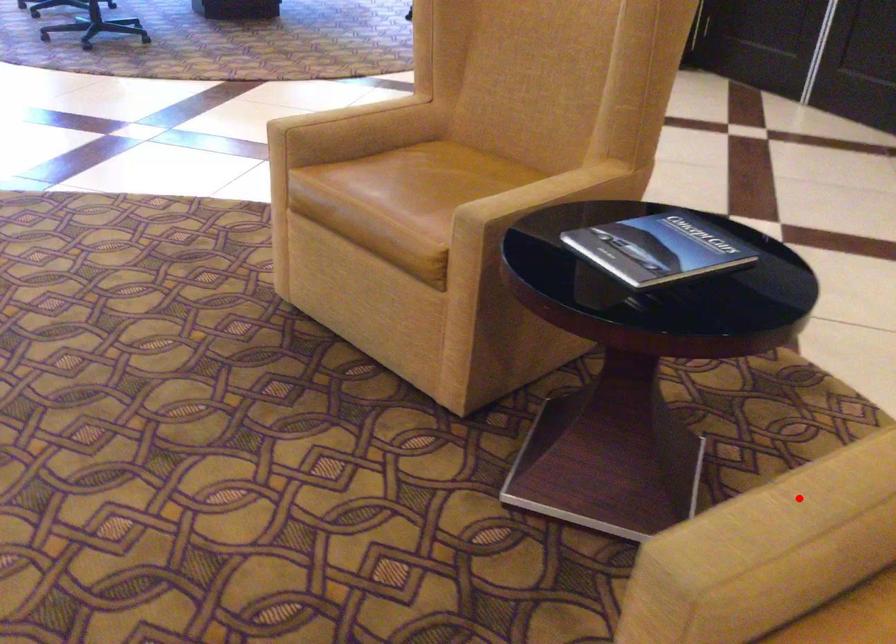
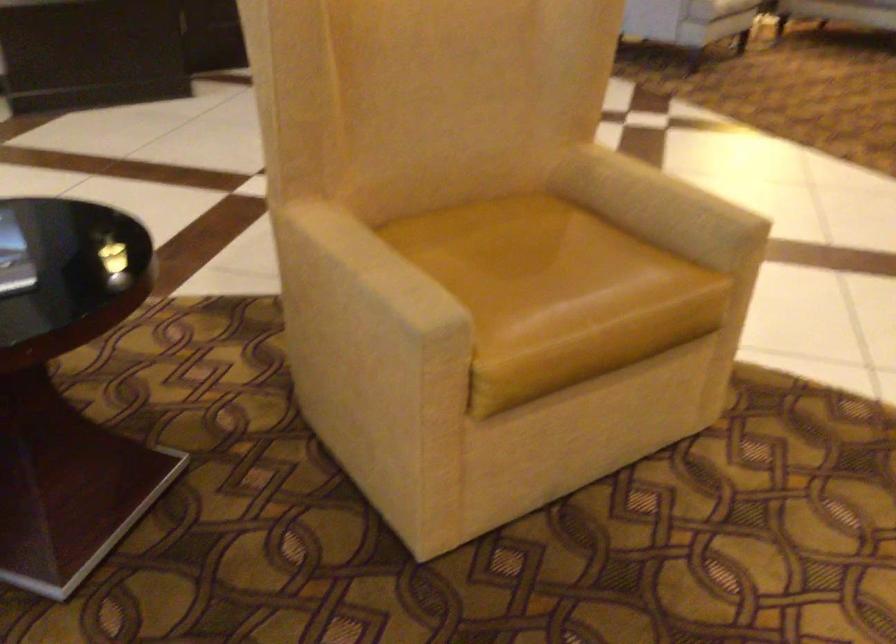
Question: I am providing you with two images of the same scene from different viewpoints. Given a red point in image1, look at the same physical point in image2. Is it:

Choices:
 (A) Closer to the viewpoint
 (B) Farther from the viewpoint

Answer: (B)